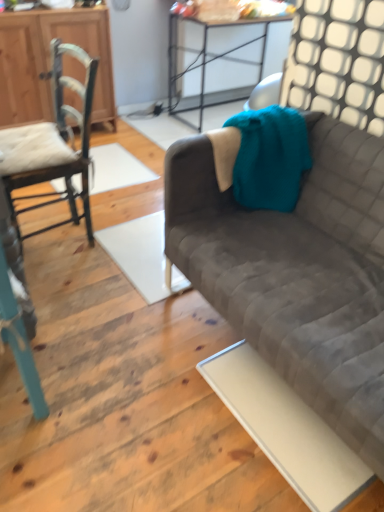
Where is `blank space situated above teal knitted blanket at upper right (from a real-world perspective)`? blank space situated above teal knitted blanket at upper right (from a real-world perspective) is located at coordinates (254, 122).